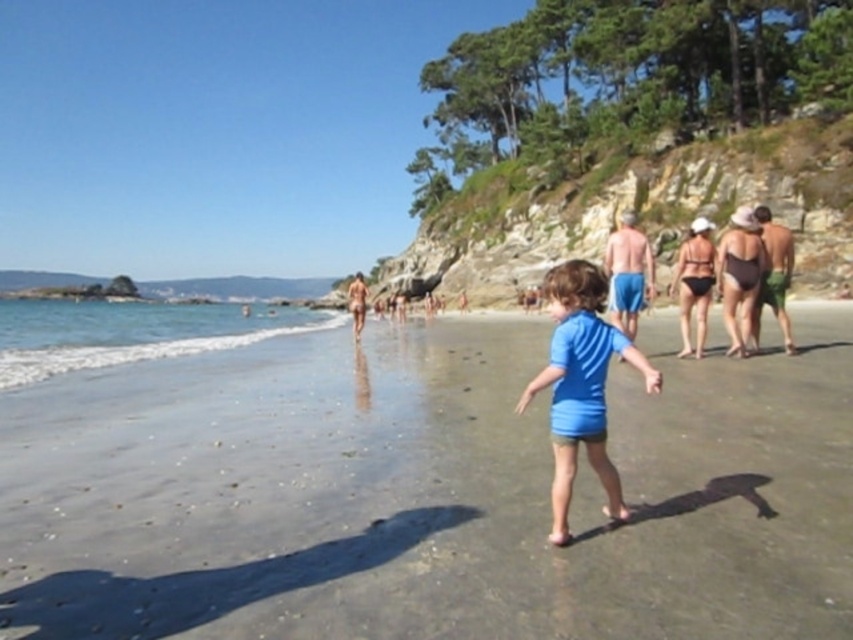
Question: From the image, what is the correct spatial relationship of blue fabric child at center in relation to matte pink bikini at center?

Choices:
 (A) right
 (B) left

Answer: (A)

Question: Can you confirm if dark brown swimsuit at right is bigger than black swimsuit at center?

Choices:
 (A) no
 (B) yes

Answer: (B)

Question: Can you confirm if clear blue water at lower left is bigger than black swimsuit at center?

Choices:
 (A) yes
 (B) no

Answer: (A)

Question: Based on their relative distances, which object is nearer to the green fabric shorts at right?

Choices:
 (A) clear blue water at lower left
 (B) blue fabric child at center

Answer: (B)

Question: Which point is farther to the camera?

Choices:
 (A) (646, 250)
 (B) (693, 285)
 (C) (786, 333)

Answer: (A)

Question: Based on their relative distances, which object is farther from the blue fabric child at center?

Choices:
 (A) blue shorts at center
 (B) blue matte shirt at center
 (C) black swimsuit at center
 (D) dark brown swimsuit at right

Answer: (D)